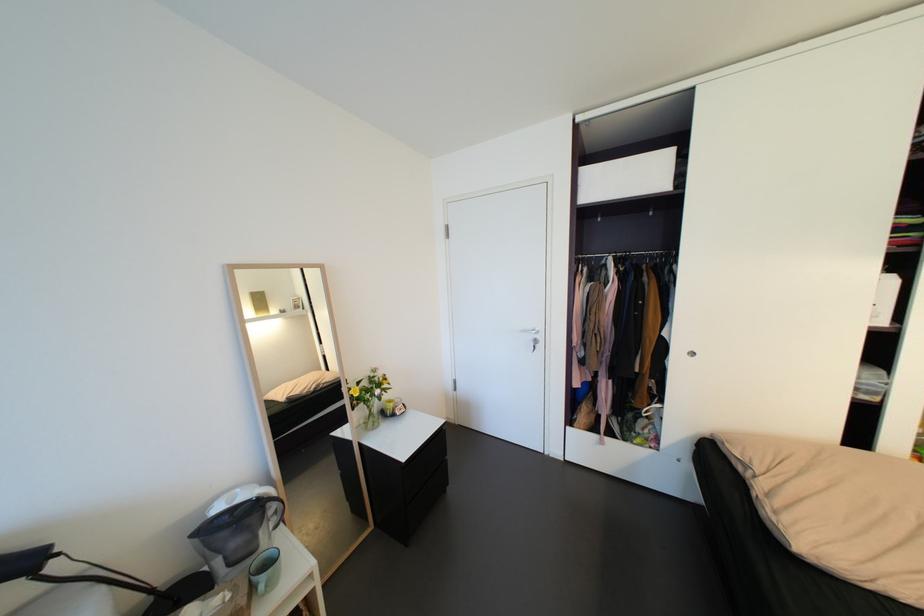
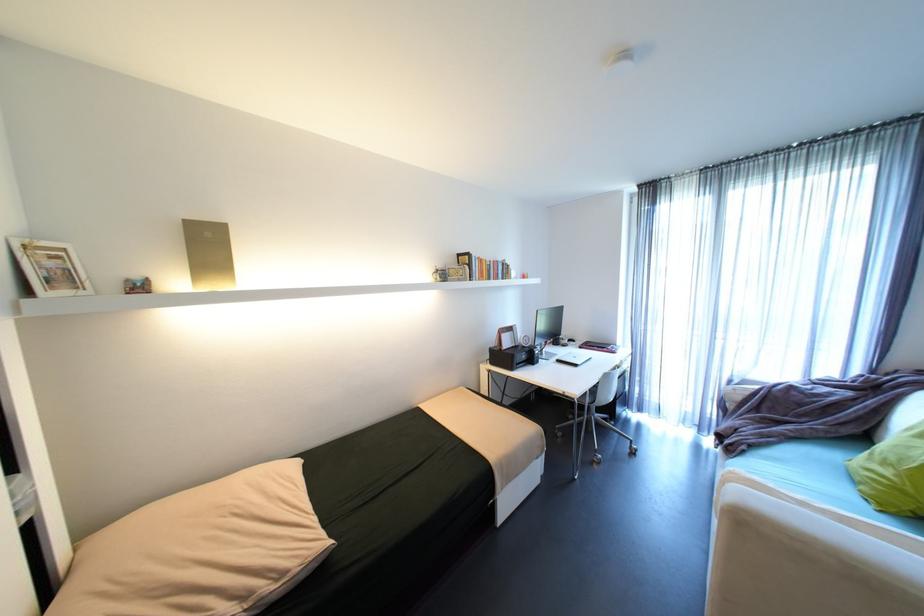
Find the pixel in the second image that matches (x=784, y=513) in the first image.

(289, 575)